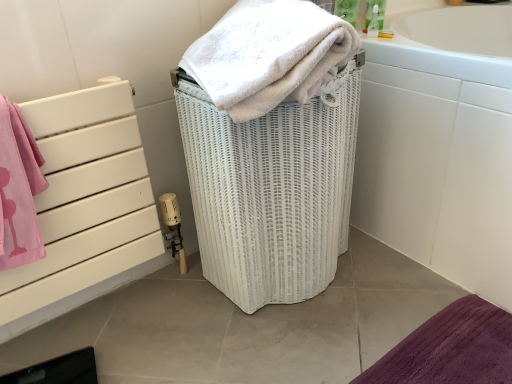
Identify the location of white wicker basket at center. (271, 189).

Describe the element at coordinates (269, 55) in the screenshot. I see `white soft towel at center` at that location.

Where is `white wicker basket at center`? The height and width of the screenshot is (384, 512). white wicker basket at center is located at coordinates (271, 189).

Considering the relative positions of white soft towel at center and white wicker basket at center in the image provided, is white soft towel at center to the left or to the right of white wicker basket at center?

Clearly, white soft towel at center is on the left of white wicker basket at center in the image.

Is point (243, 83) less distant than point (354, 154)?

Yes, it is.

Can you confirm if white soft towel at center is bigger than white wicker basket at center?

No.

Is white soft towel at center located outside white wicker basket at center?

Yes.

From the image's perspective, is white wicker basket at center above or below white soft towel at center?

Based on their image positions, white wicker basket at center is located beneath white soft towel at center.

Is the position of white wicker basket at center more distant than that of white soft towel at center?

Yes, white wicker basket at center is further from the viewer.

Based on the photo, is the surface of white wicker basket at center in direct contact with white soft towel at center?

No, white wicker basket at center is not with white soft towel at center.

Is white wicker basket at center shorter than white soft towel at center?

In fact, white wicker basket at center may be taller than white soft towel at center.

From the image's perspective, is white soft towel at center over white glossy bathtub at right?

Yes, from the image's perspective, white soft towel at center is over white glossy bathtub at right.

Does white soft towel at center have a smaller size compared to white glossy bathtub at right?

Yes, white soft towel at center is smaller than white glossy bathtub at right.

Which is nearer, [306,30] or [403,100]?

Point [306,30] is closer to the camera than point [403,100].

Which of these two, white glossy bathtub at right or white soft towel at center, is thinner?

white soft towel at center.

Can you confirm if white glossy bathtub at right is positioned to the right of white soft towel at center?

Yes.

Identify the location of bath located on the right of white soft towel at center. The width and height of the screenshot is (512, 384). (441, 145).

Which is in front, point (393, 94) or point (334, 53)?

The point (334, 53) is more forward.

From a real-world perspective, is white wicker basket at center on top of white glossy bathtub at right?

Actually, white wicker basket at center is physically below white glossy bathtub at right in the real world.

From the image's perspective, which is below, white wicker basket at center or white glossy bathtub at right?

white wicker basket at center is shown below in the image.

Consider the image. Does white wicker basket at center have a greater width compared to white glossy bathtub at right?

In fact, white wicker basket at center might be narrower than white glossy bathtub at right.

Is white wicker basket at center at the back of white glossy bathtub at right?

No, white glossy bathtub at right is not facing away from white wicker basket at center.

From a real-world perspective, relative to white wicker basket at center, is white glossy bathtub at right vertically above or below?

Clearly, from a real-world perspective, white glossy bathtub at right is above white wicker basket at center.

Does white glossy bathtub at right appear on the right side of white wicker basket at center?

Yes, white glossy bathtub at right is to the right of white wicker basket at center.

The height and width of the screenshot is (384, 512). What are the coordinates of `bath lying on the right of white wicker basket at center` in the screenshot? It's located at (441, 145).

This screenshot has width=512, height=384. I want to click on basket container below the white soft towel at center (from the image's perspective), so click(x=271, y=189).

I want to click on towel above the white wicker basket at center (from the image's perspective), so click(x=269, y=55).

When comparing their distances from white wicker basket at center, does white soft towel at center or white glossy bathtub at right seem closer?

Based on the image, white soft towel at center appears to be nearer to white wicker basket at center.

Looking at the image, which one is located further to white wicker basket at center, white glossy bathtub at right or white soft towel at center?

white glossy bathtub at right is positioned further to the anchor white wicker basket at center.

Which object lies nearer to the anchor point white glossy bathtub at right, white soft towel at center or white wicker basket at center?

white wicker basket at center.

Which object lies nearer to the anchor point white soft towel at center, white glossy bathtub at right or white wicker basket at center?

The object closer to white soft towel at center is white wicker basket at center.

Based on their spatial positions, is white wicker basket at center or white glossy bathtub at right closer to white soft towel at center?

white wicker basket at center.

Considering their positions, is white wicker basket at center positioned closer to white glossy bathtub at right than white soft towel at center?

white wicker basket at center.

The height and width of the screenshot is (384, 512). What are the coordinates of `basket container between white soft towel at center and white glossy bathtub at right in the horizontal direction` in the screenshot? It's located at (271, 189).